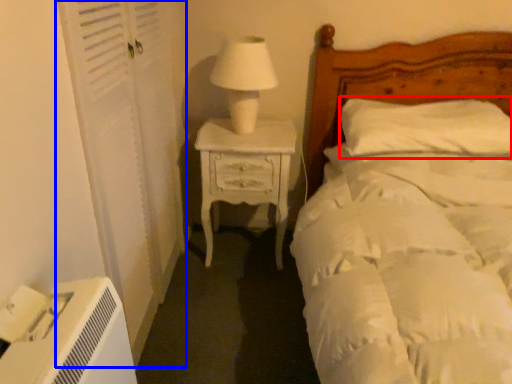
Question: Which object is closer to the camera taking this photo, pillow (highlighted by a red box) or screen door (highlighted by a blue box)?

Choices:
 (A) pillow
 (B) screen door

Answer: (B)